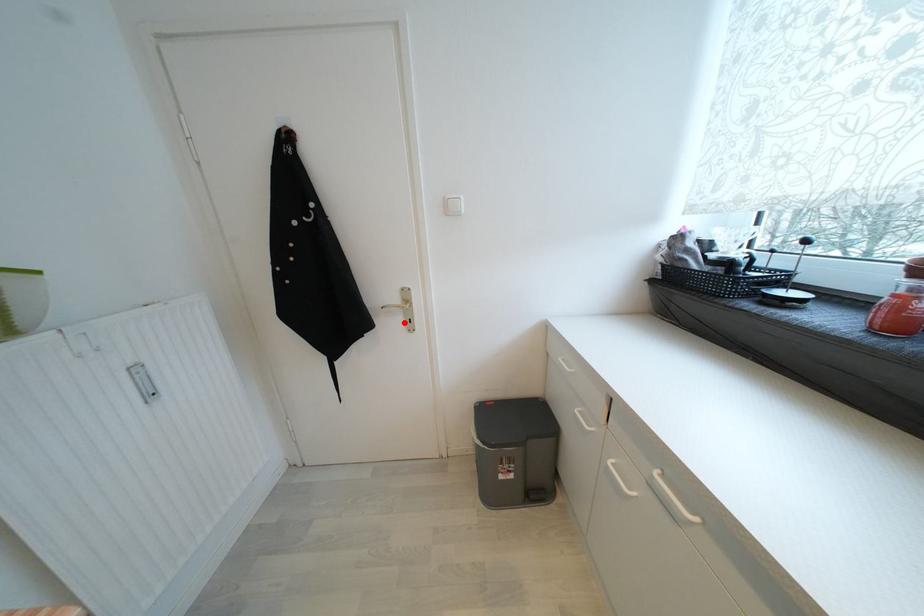
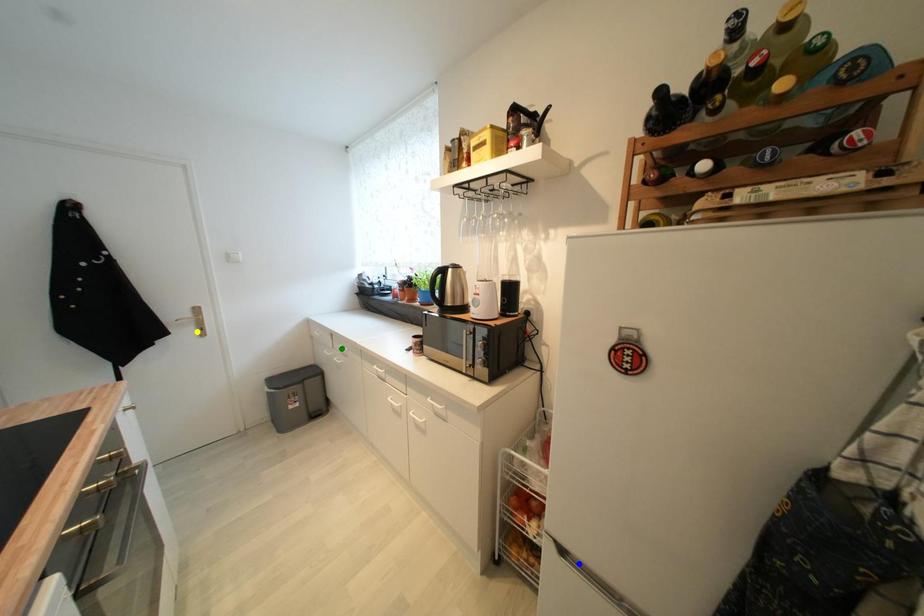
Question: I am providing you with two images of the same scene from different viewpoints. A red point is marked on the first image. You are given multiple points on the second image. Which point in image 2 represents the same 3d spot as the red point in image 1?

Choices:
 (A) blue point
 (B) yellow point
 (C) green point

Answer: (B)